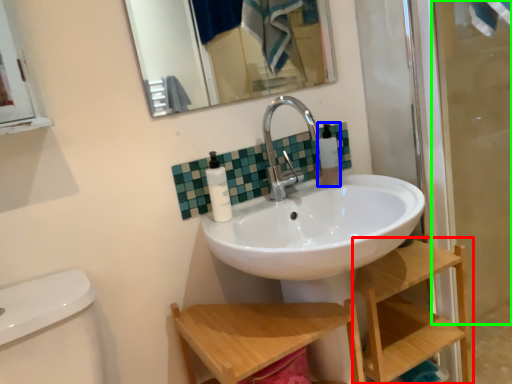
Question: Based on their relative distances, which object is farther from shelf (highlighted by a red box)? Choose from toiletry (highlighted by a blue box) and screen door (highlighted by a green box).

Choices:
 (A) toiletry
 (B) screen door

Answer: (B)